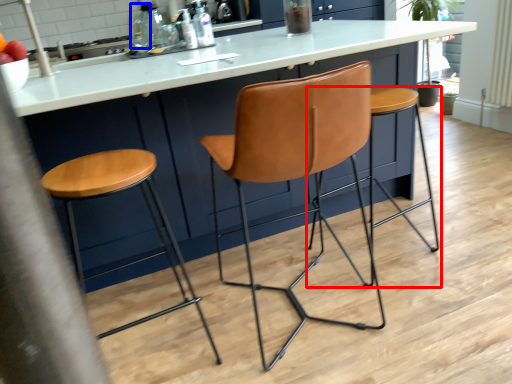
Question: Which object is further to the camera taking this photo, stool (highlighted by a red box) or bottle (highlighted by a blue box)?

Choices:
 (A) stool
 (B) bottle

Answer: (B)